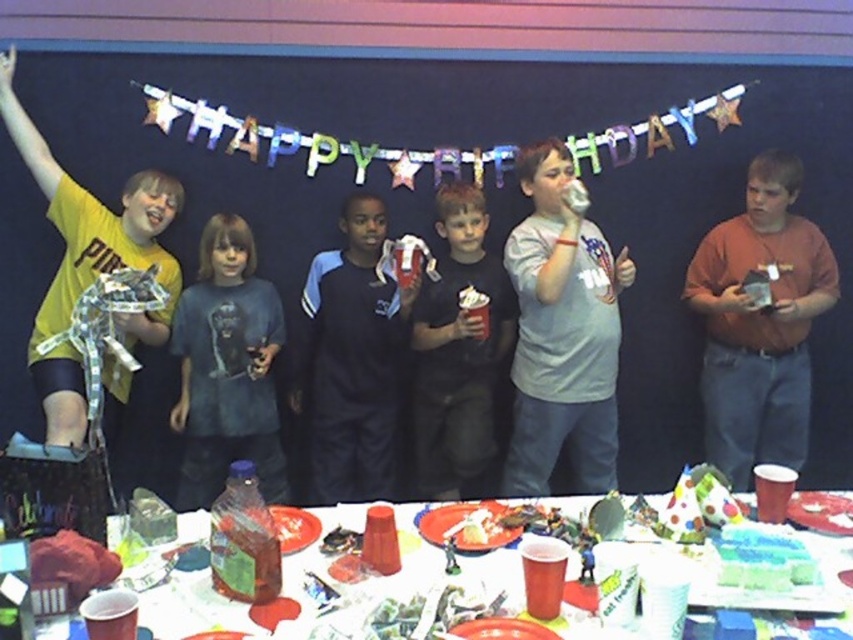
Is plastic red cups at lower center to the left of brown cotton shirt at right from the viewer's perspective?

Correct, you'll find plastic red cups at lower center to the left of brown cotton shirt at right.

Between point (647, 634) and point (831, 256), which one is positioned in front?

Positioned in front is point (647, 634).

Which is behind, point (154, 593) or point (741, 369)?

Positioned behind is point (741, 369).

Locate an element on the screen. The image size is (853, 640). plastic red cups at lower center is located at coordinates (337, 589).

Can you confirm if gray matte shirt at center is taller than blue frosted cake at lower center?

Indeed, gray matte shirt at center has a greater height compared to blue frosted cake at lower center.

Consider the image. Which is below, gray matte shirt at center or blue frosted cake at lower center?

blue frosted cake at lower center is below.

Describe the element at coordinates (561, 333) in the screenshot. Image resolution: width=853 pixels, height=640 pixels. I see `gray matte shirt at center` at that location.

This screenshot has width=853, height=640. I want to click on gray matte shirt at center, so click(x=561, y=333).

Between point (339, 616) and point (428, 440), which one is positioned behind?

The point (428, 440) is more distant.

Is point (827, 611) closer to viewer compared to point (482, 234)?

That is True.

You are a GUI agent. You are given a task and a screenshot of the screen. Output one action in this format:
    pyautogui.click(x=<x>, y=<y>)
    Task: Click on the plastic red cups at lower center
    The height and width of the screenshot is (640, 853).
    Given the screenshot: What is the action you would take?
    pyautogui.click(x=337, y=589)